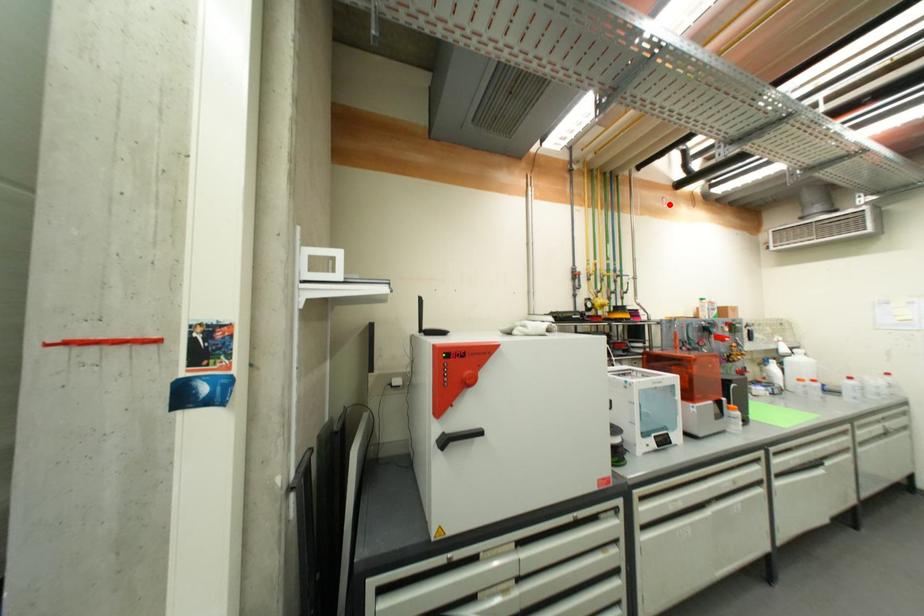
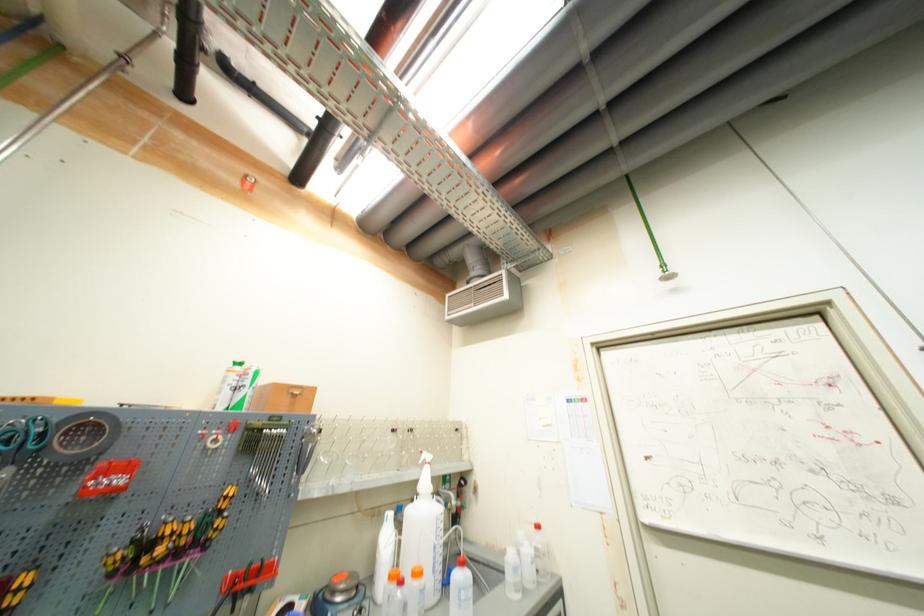
The point at the highlighted location is marked in the first image. Where is the corresponding point in the second image?

(253, 185)